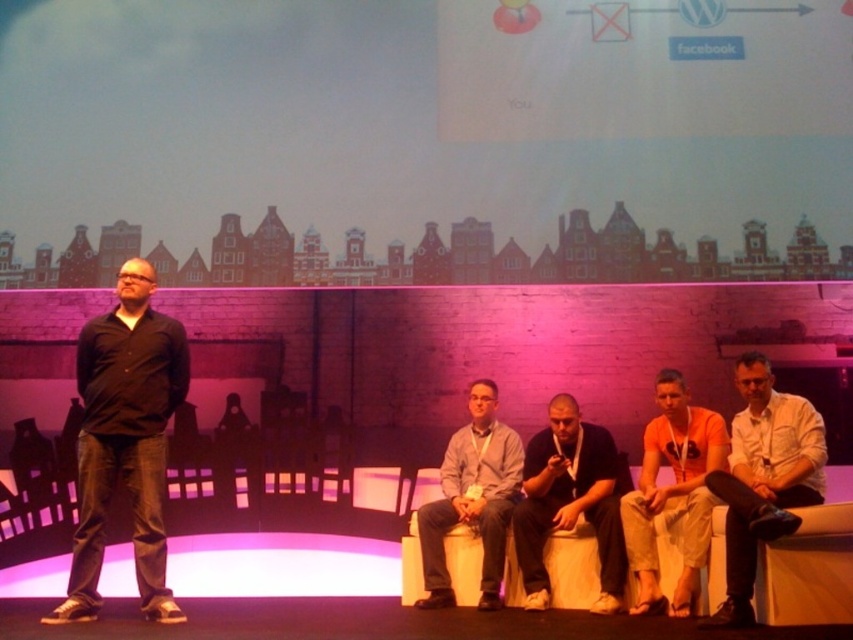
You are an event planner arranging a photoshoot. You need to ensure that the white cotton shirt at lower right and the dark gray fabric shirt at center are visible in the photo. Based on their positions, which shirt is covering part of the other?

The white cotton shirt at lower right is positioned over the dark gray fabric shirt at center, so it is covering part of the latter.

In the stage setting, there are several people sitting on a curved white bench and one standing on the left. You see a point marked at coordinates (x=672, y=493). What object is located at that point?

The point at (x=672, y=493) indicates the orange cotton shirt at center.

In the scene shown: You are a photographer positioned at the camera. You want to capture a closeup shot of the dark gray fabric shirt at center. Given that your camera can focus on objects within 2 meters, will you be able to take the closeup shot?

The dark gray fabric shirt at center is 3.96 meters away from the camera. Since the camera can only focus on objects within 2 meters, you will not be able to take a closeup shot of the dark gray fabric shirt at center.